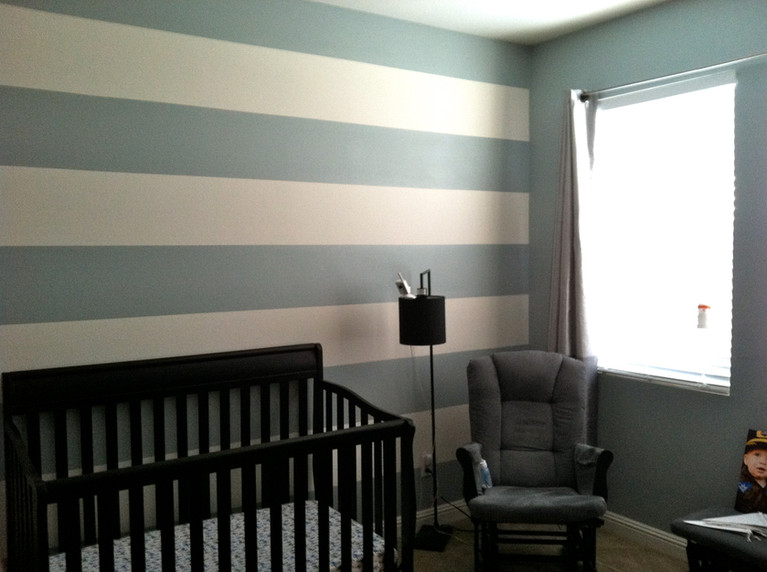
Where is `baby monitor`? This screenshot has width=767, height=572. baby monitor is located at coordinates (405, 284).